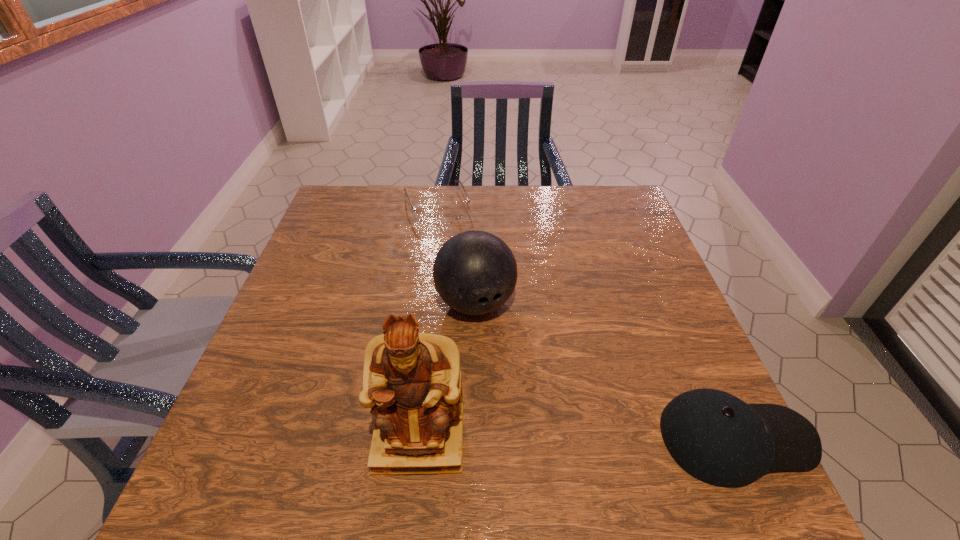
The image size is (960, 540). Find the location of `free spot between the rightmost object and the bowling ball`. free spot between the rightmost object and the bowling ball is located at coordinates (605, 370).

Where is `vacant point located between the third nearest object and the third tallest object`? vacant point located between the third nearest object and the third tallest object is located at coordinates point(605,370).

Find the location of a particular element. This screenshot has height=540, width=960. the second closest object to the shortest object is located at coordinates (412, 382).

Identify which object is located as the nearest to the farthest object. Please provide its 2D coordinates. Your answer should be formatted as a tuple, i.e. [(x, y)], where the tuple contains the x and y coordinates of a point satisfying the conditions above.

[(475, 272)]

This screenshot has width=960, height=540. Find the location of `vacant space that satisfies the following two spatial constraints: 1. on the front side of the farthest object; 2. on the front-facing side of the third tallest object`. vacant space that satisfies the following two spatial constraints: 1. on the front side of the farthest object; 2. on the front-facing side of the third tallest object is located at coordinates (406, 438).

Identify the location of vacant region that satisfies the following two spatial constraints: 1. on the front side of the second shortest object; 2. on the front-facing side of the second tallest object. tap(474, 438).

At what (x,y) coordinates should I click in order to perform the action: click on vacant space that satisfies the following two spatial constraints: 1. on the front side of the shortest object; 2. on the right side of the third nearest object. Please return your answer as a coordinate pair (x, y). This screenshot has width=960, height=540. Looking at the image, I should click on (424, 303).

The height and width of the screenshot is (540, 960). Find the location of `vacant space that satisfies the following two spatial constraints: 1. on the front-facing side of the figurine; 2. on the front-facing side of the baseball cap`. vacant space that satisfies the following two spatial constraints: 1. on the front-facing side of the figurine; 2. on the front-facing side of the baseball cap is located at coordinates (420, 438).

In order to click on vacant space that satisfies the following two spatial constraints: 1. on the front-facing side of the figurine; 2. on the front-facing side of the baseball cap in this screenshot , I will do `click(420, 438)`.

Identify the location of blank space that satisfies the following two spatial constraints: 1. on the front-facing side of the rightmost object; 2. on the front-facing side of the tallest object. (420, 438).